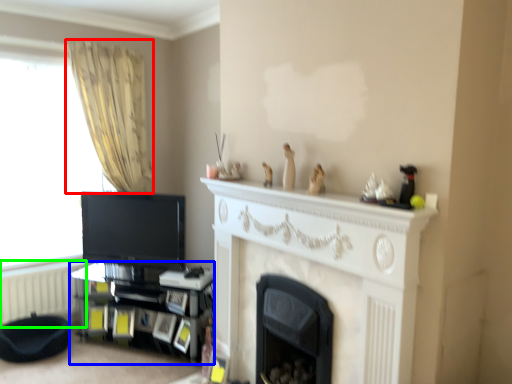
Question: Considering the real-world distances, which object is farthest from curtain (highlighted by a red box)? shelf (highlighted by a blue box) or radiator (highlighted by a green box)?

Choices:
 (A) shelf
 (B) radiator

Answer: (B)